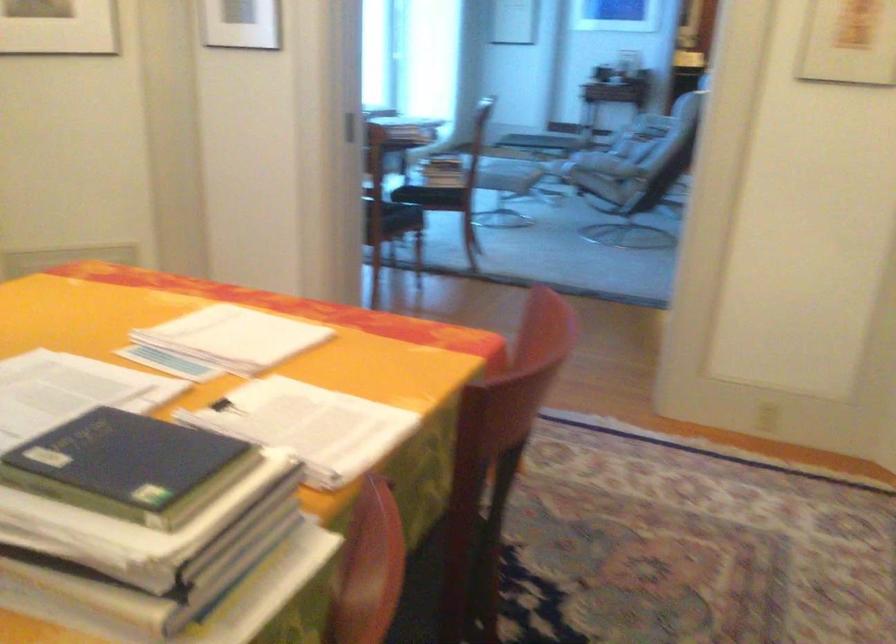
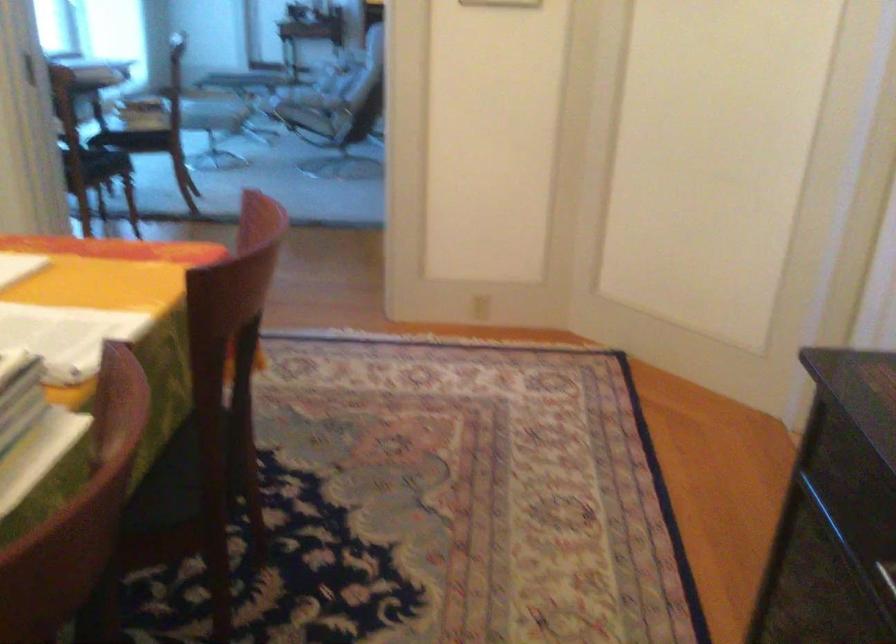
Question: The images are taken continuously from a first-person perspective. In which direction are you moving?

Choices:
 (A) Left
 (B) Right
 (C) Forward
 (D) Backward

Answer: (D)